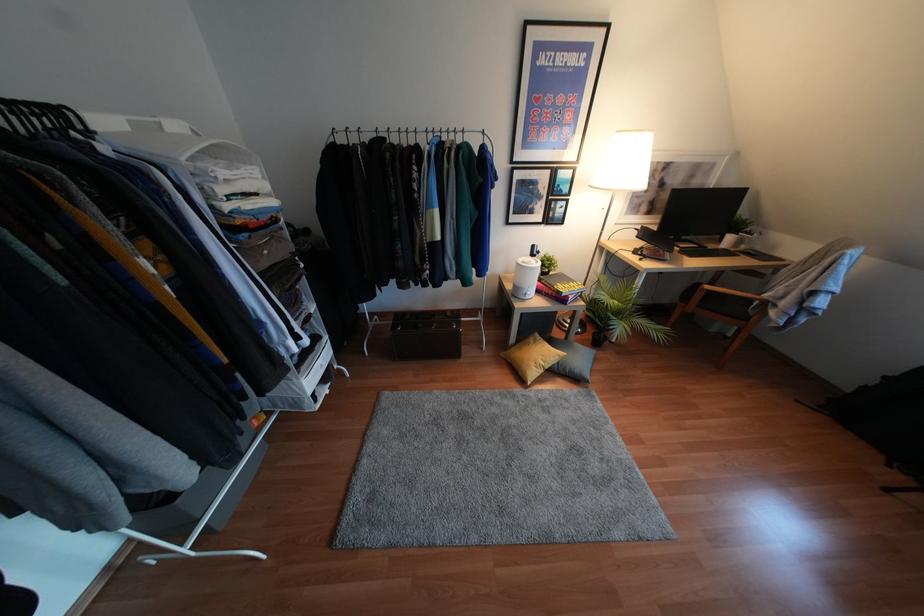
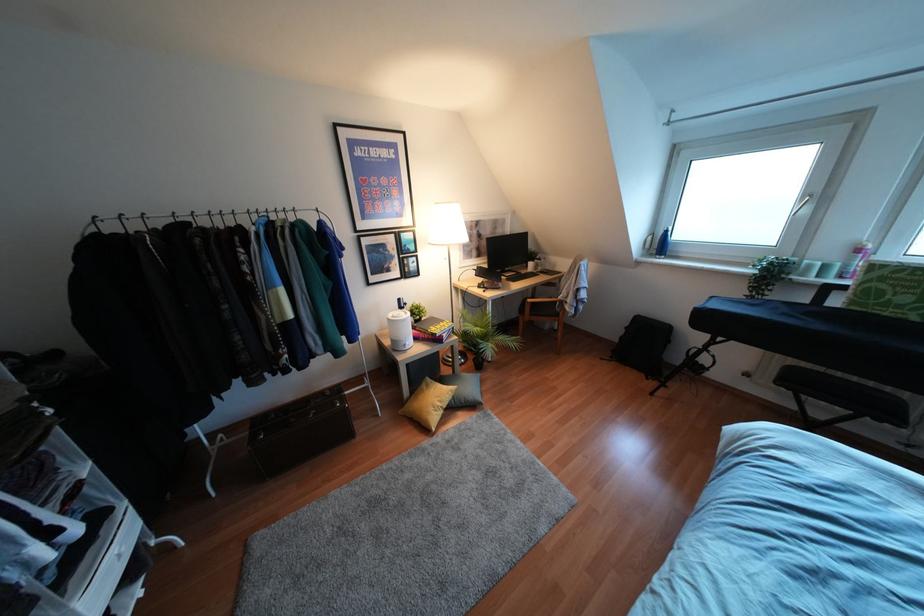
Locate, in the second image, the point that corresponds to [570,283] in the first image.

(441, 323)